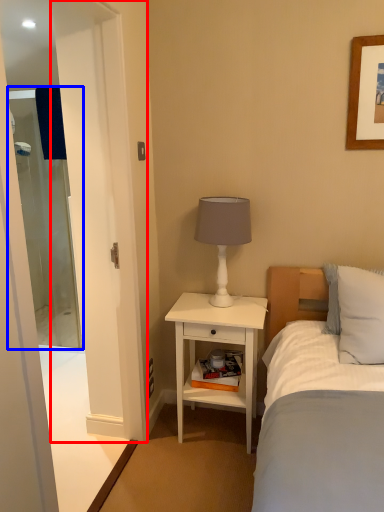
Question: Which point is closer to the camera, screen door (highlighted by a red box) or screen door (highlighted by a blue box)?

Choices:
 (A) screen door
 (B) screen door

Answer: (A)